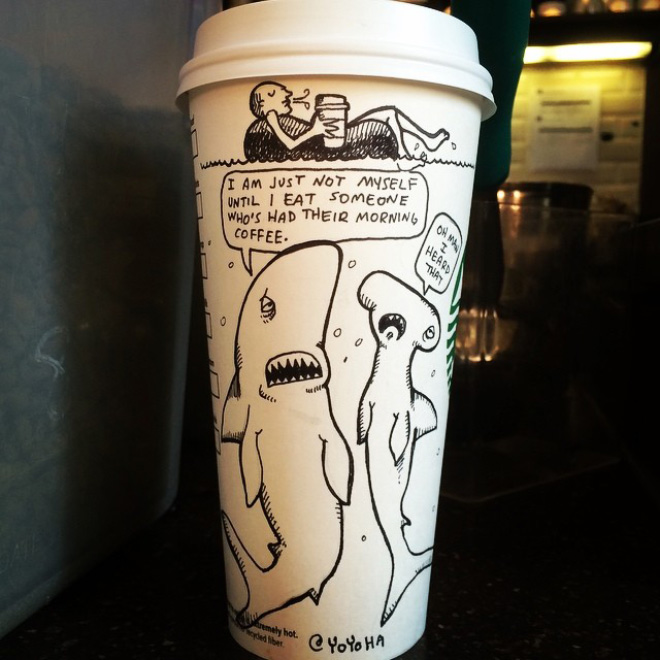
Locate an element on the screen. coffee cup lid is located at coordinates (381, 32), (333, 99).